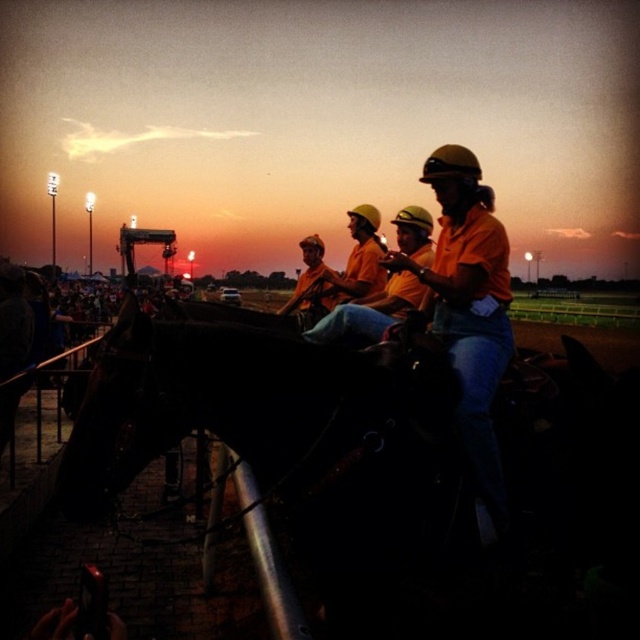
Between black glossy horse at center and orange hard hat at center, which one has less height?

orange hard hat at center

Looking at this image, between black glossy horse at center and orange hard hat at center, which one appears on the left side from the viewer's perspective?

Positioned to the left is orange hard hat at center.

The width and height of the screenshot is (640, 640). What are the coordinates of `black glossy horse at center` in the screenshot? It's located at (378, 456).

Does point (476, 348) come farther from viewer compared to point (353, 308)?

Yes, it is behind point (353, 308).

Can you confirm if orange cotton shirt at center is positioned above orange hard hat at center?

Actually, orange cotton shirt at center is below orange hard hat at center.

Which is behind, point (451, 316) or point (336, 337)?

Point (451, 316)

Where is `orange cotton shirt at center`? The image size is (640, 640). orange cotton shirt at center is located at coordinates (468, 312).

How distant is black glossy horse at center from orange cotton shirt at center?

black glossy horse at center is 81.09 centimeters from orange cotton shirt at center.

This screenshot has height=640, width=640. Find the location of `black glossy horse at center`. black glossy horse at center is located at coordinates (x=378, y=456).